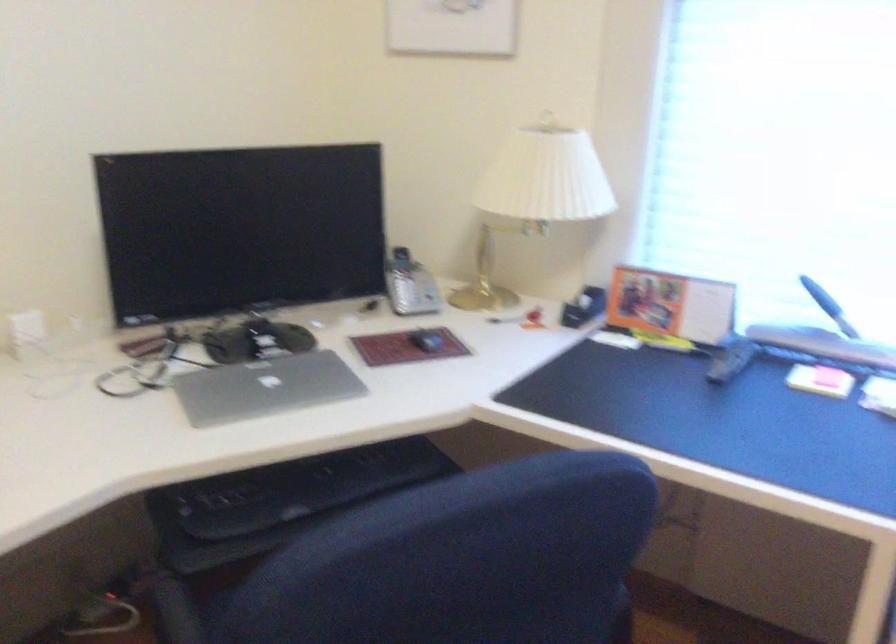
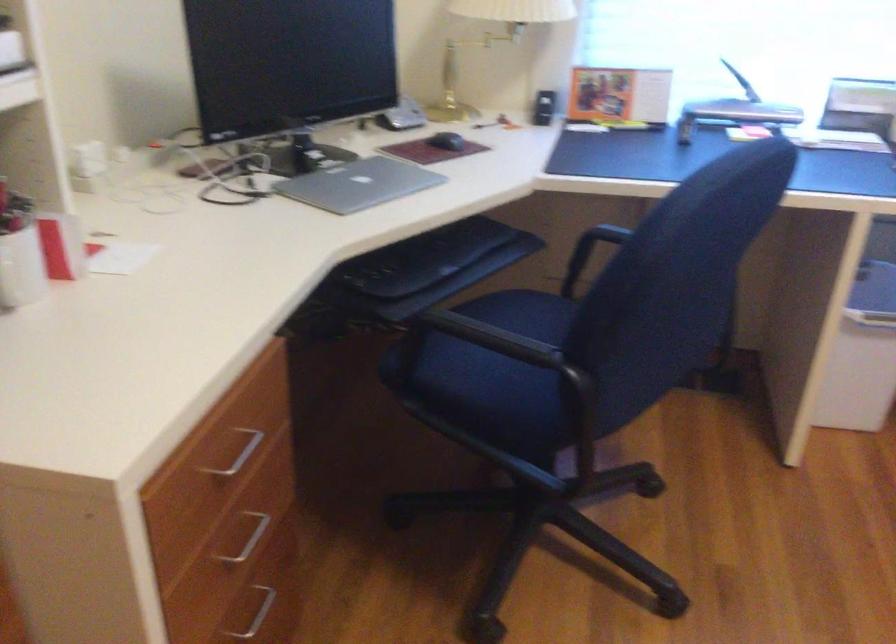
The point at (255, 389) is marked in the first image. Where is the corresponding point in the second image?

(358, 184)